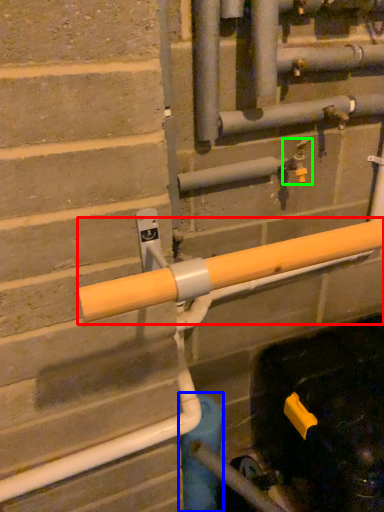
Question: Based on their relative distances, which object is nearer to beam (highlighted by a red box)? Choose from water pipe (highlighted by a blue box) and plumbing fixture (highlighted by a green box).

Choices:
 (A) water pipe
 (B) plumbing fixture

Answer: (B)